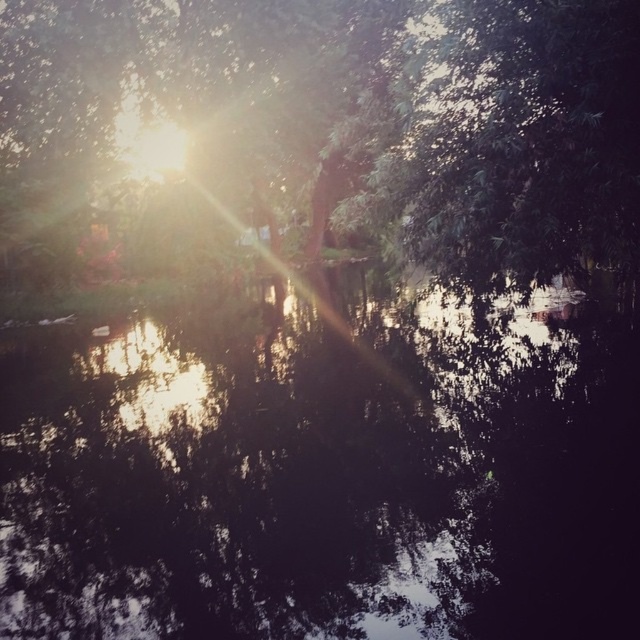
Can you confirm if black reflective water at center is thinner than green leafy tree at upper center?

Yes, black reflective water at center is thinner than green leafy tree at upper center.

Is black reflective water at center further to camera compared to green leafy tree at upper center?

No.

Is point (502, 484) farther from viewer compared to point (397, 172)?

No, (502, 484) is closer to viewer.

Locate an element on the screen. The image size is (640, 640). black reflective water at center is located at coordinates (324, 472).